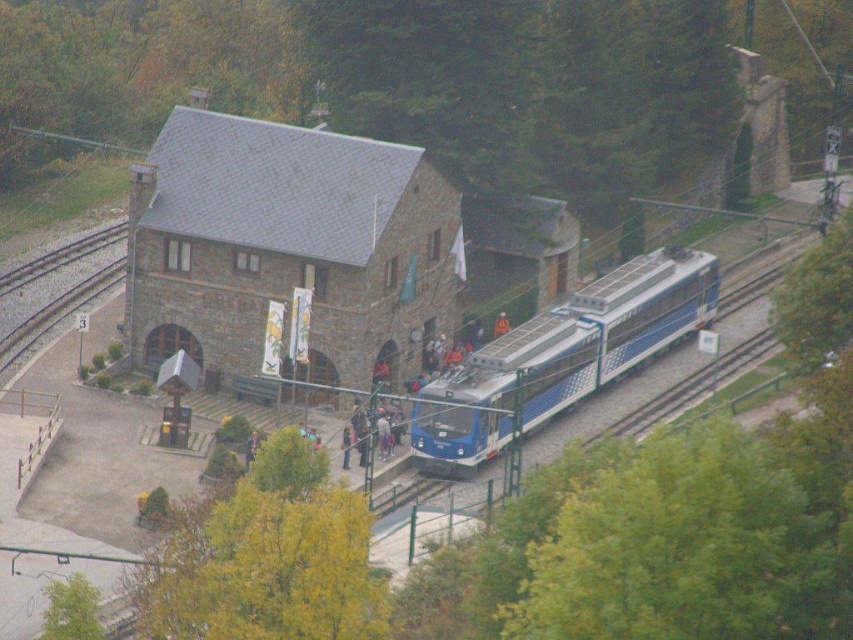
You are standing at the train station and want to enter the stone textured building at center. However, there is an orange fabric person at center blocking the entrance. Can you walk around them to get inside?

The stone textured building at center is above the orange fabric person at center, which means the person is standing at the base of the building. You can walk around them to enter the building.

You are a visitor at the train station and want to take a photo that includes both the green leafy tree at lower right and the green leafy tree at lower left. Which tree should you position closer to the camera to ensure both are fully visible in the frame?

To ensure both the green leafy tree at lower right and the green leafy tree at lower left are fully visible in the frame, you should position the green leafy tree at lower right closer to the camera since it occupies less space and will appear smaller in the photo, allowing both trees to fit within the frame.

In the scene shown: You are standing at the train station and want to take a photo of the green leafy tree at upper center. If your camera has a maximum focus range of 80 meters, will you be able to capture the tree clearly?

The green leafy tree at upper center is 77.53 meters away from the viewer. Since the camera can focus up to 80 meters, it is within range, so yes, you can capture the tree clearly.